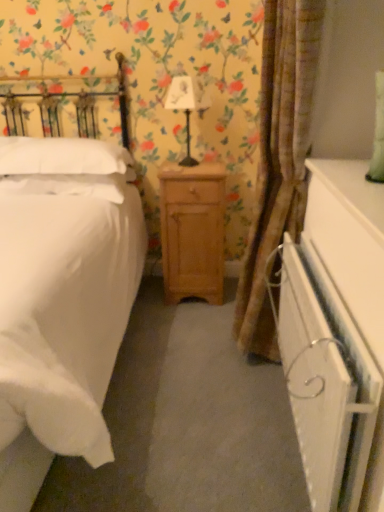
In order to click on vacant space underneath brown textured curtain at center (from a real-world perspective) in this screenshot , I will do coord(251,379).